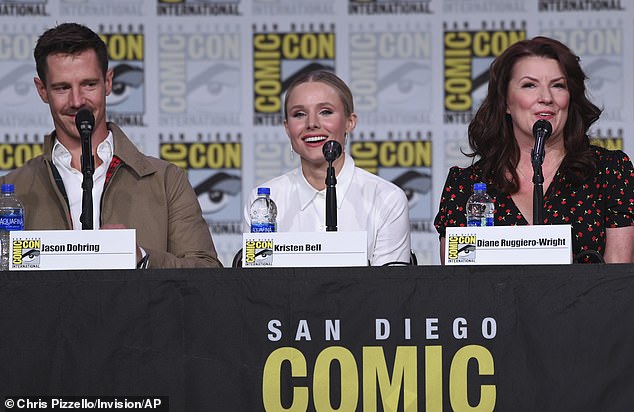
What are the coordinates of `speakers` in the screenshot? It's located at (375, 214).